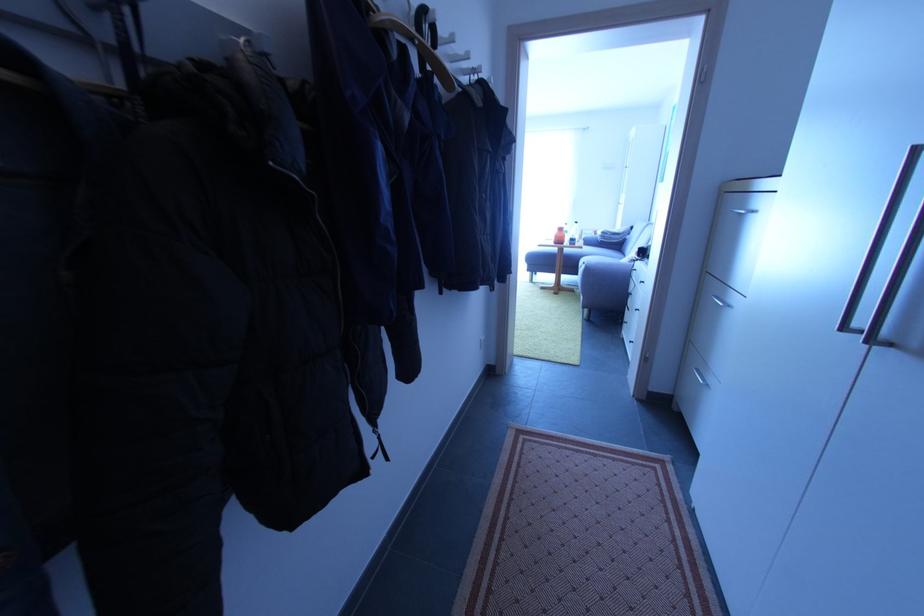
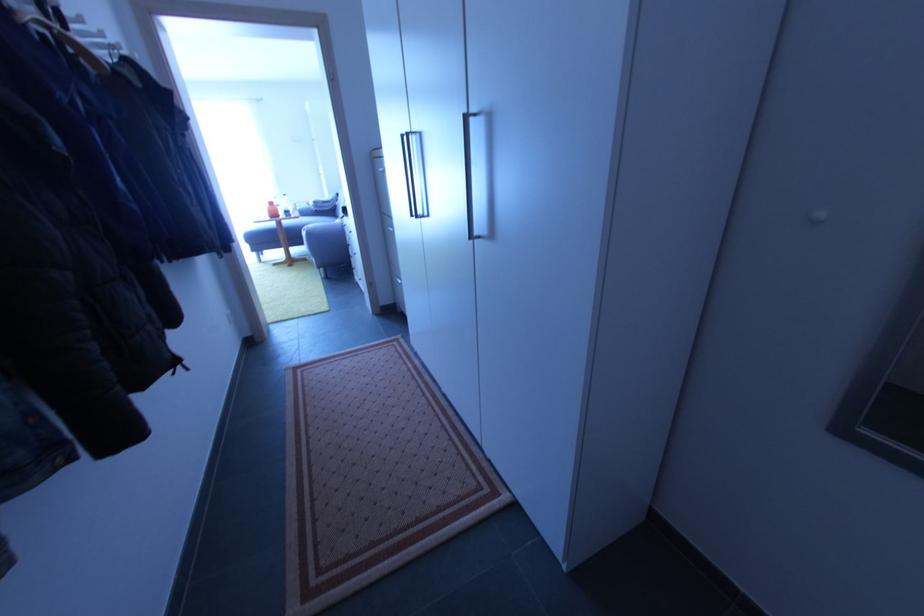
Find the pixel in the second image that matches [592,245] in the first image.

(310, 216)